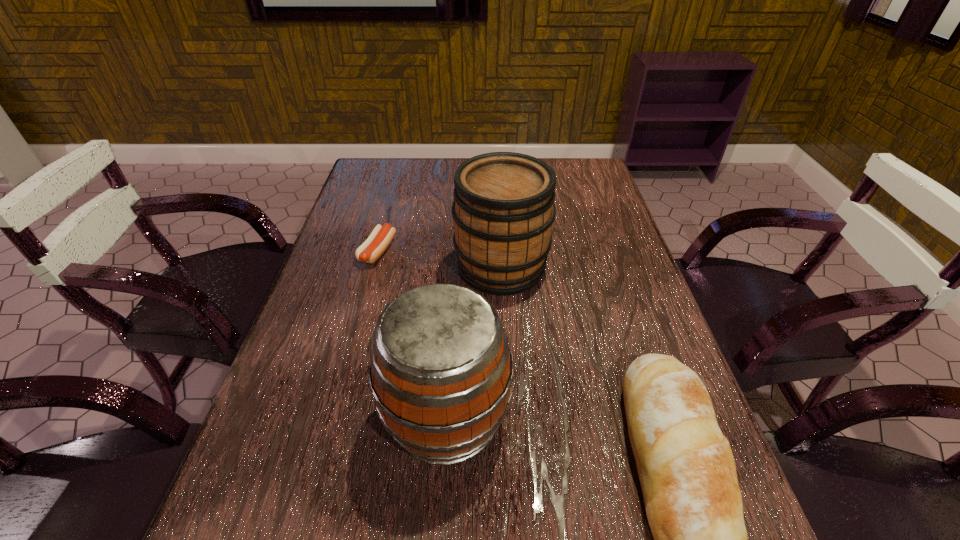
At what (x,y) coordinates should I click in order to perform the action: click on the farther cider. Please return your answer as a coordinate pair (x, y). The image size is (960, 540). Looking at the image, I should click on (503, 209).

Locate an element on the screen. Image resolution: width=960 pixels, height=540 pixels. the nearer cider is located at coordinates (441, 370).

This screenshot has height=540, width=960. I want to click on the shortest object, so click(380, 238).

Identify the location of the leftmost object. (380, 238).

The width and height of the screenshot is (960, 540). Identify the location of vacant space located 0.080m on the left of the farther cider. (422, 266).

This screenshot has height=540, width=960. What are the coordinates of `vacant region located on the right of the nearer cider` in the screenshot? It's located at (693, 417).

At what (x,y) coordinates should I click in order to perform the action: click on free space located on the right of the sausage. Please return your answer as a coordinate pair (x, y). This screenshot has height=540, width=960. Looking at the image, I should click on (471, 251).

Locate an element on the screen. object that is at the left edge is located at coordinates (380, 238).

Find the location of `vacant space at the left edge of the desktop`. vacant space at the left edge of the desktop is located at coordinates (356, 298).

Identify the location of free space at the right edge. (605, 376).